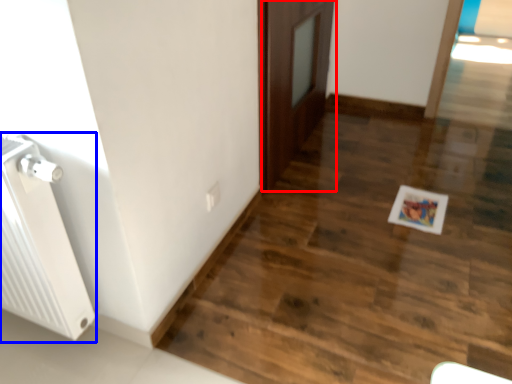
Question: Which point is closer to the camera, door (highlighted by a red box) or radiator (highlighted by a blue box)?

Choices:
 (A) door
 (B) radiator

Answer: (B)